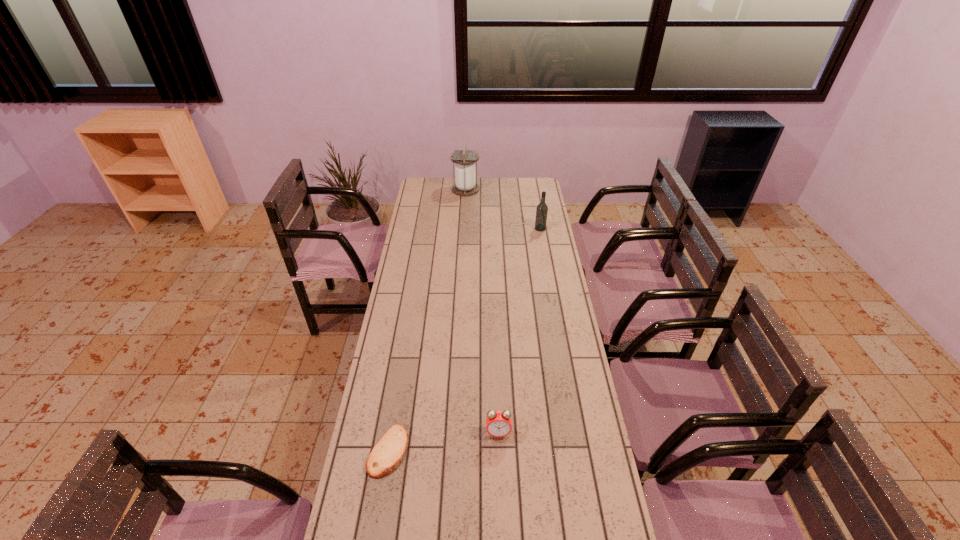
Locate an element on the screen. The height and width of the screenshot is (540, 960). free space between the alarm clock and the farthest object is located at coordinates (482, 311).

Locate an element on the screen. The image size is (960, 540). free space between the alarm clock and the third nearest object is located at coordinates (519, 330).

What are the coordinates of `unoccupied position between the third shortest object and the tallest object` in the screenshot? It's located at (503, 209).

The width and height of the screenshot is (960, 540). Identify the location of vacant space that's between the rightmost object and the tallest object. (503, 209).

Where is `vacant point located between the vodka and the pita bread`? The height and width of the screenshot is (540, 960). vacant point located between the vodka and the pita bread is located at coordinates (465, 340).

At what (x,y) coordinates should I click in order to perform the action: click on free space between the tallest object and the third tallest object. Please return your answer as a coordinate pair (x, y). The height and width of the screenshot is (540, 960). Looking at the image, I should click on (482, 311).

This screenshot has height=540, width=960. What are the coordinates of `vacant area that lies between the leftmost object and the third object from left to right` in the screenshot? It's located at (444, 442).

At what (x,y) coordinates should I click in order to perform the action: click on free space between the farthest object and the third tallest object. Please return your answer as a coordinate pair (x, y). The image size is (960, 540). Looking at the image, I should click on point(482,311).

At what (x,y) coordinates should I click in order to perform the action: click on vacant region between the third tallest object and the pita bread. Please return your answer as a coordinate pair (x, y). The width and height of the screenshot is (960, 540). Looking at the image, I should click on (444, 442).

Locate an element on the screen. free space between the tallest object and the third object from left to right is located at coordinates (482, 311).